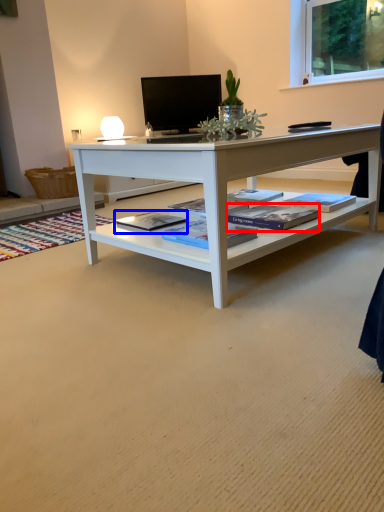
Question: Which object appears farthest to the camera in this image, book (highlighted by a red box) or book (highlighted by a blue box)?

Choices:
 (A) book
 (B) book

Answer: (B)